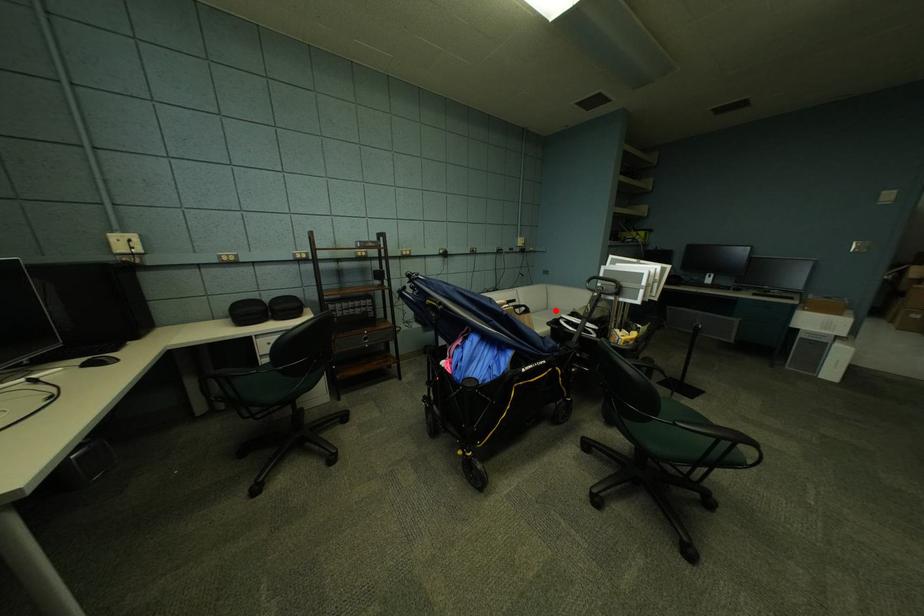
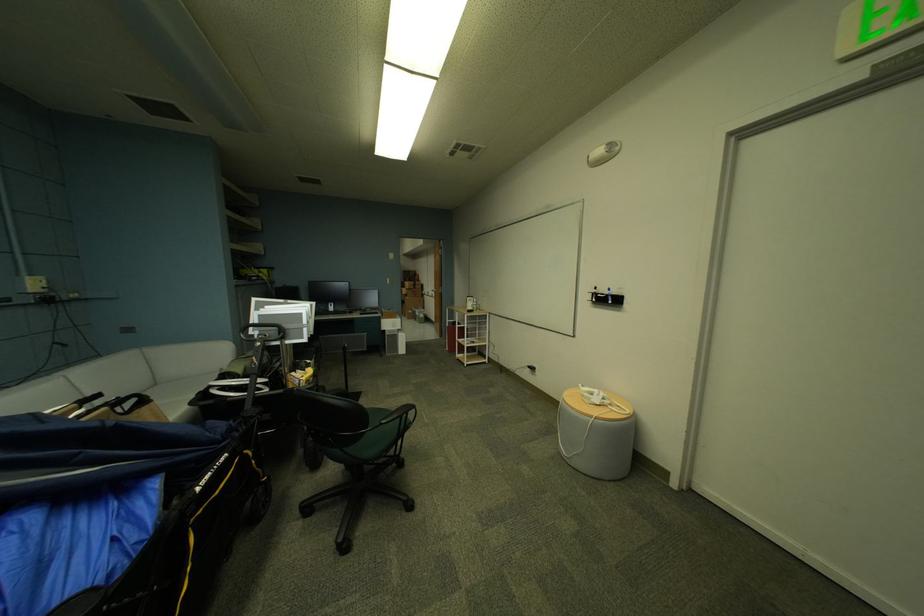
Locate, in the second image, the point that corresponds to the highlighted location in the first image.

(164, 386)